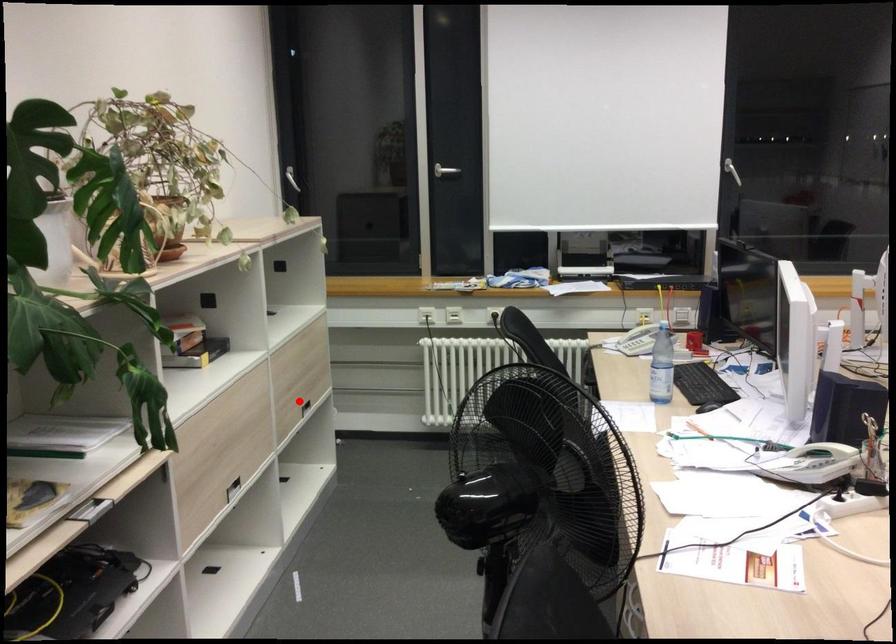
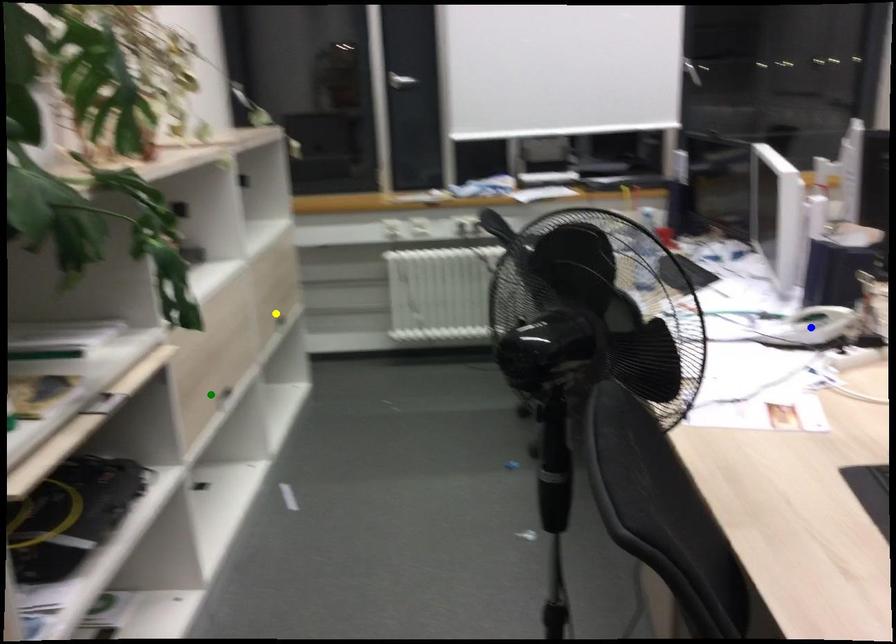
Question: I am providing you with two images of the same scene from different viewpoints. A red point is marked on the first image. You are given multiple points on the second image. Which point in image 2 represents the same 3d spot as the red point in image 1?

Choices:
 (A) yellow point
 (B) blue point
 (C) green point

Answer: (A)